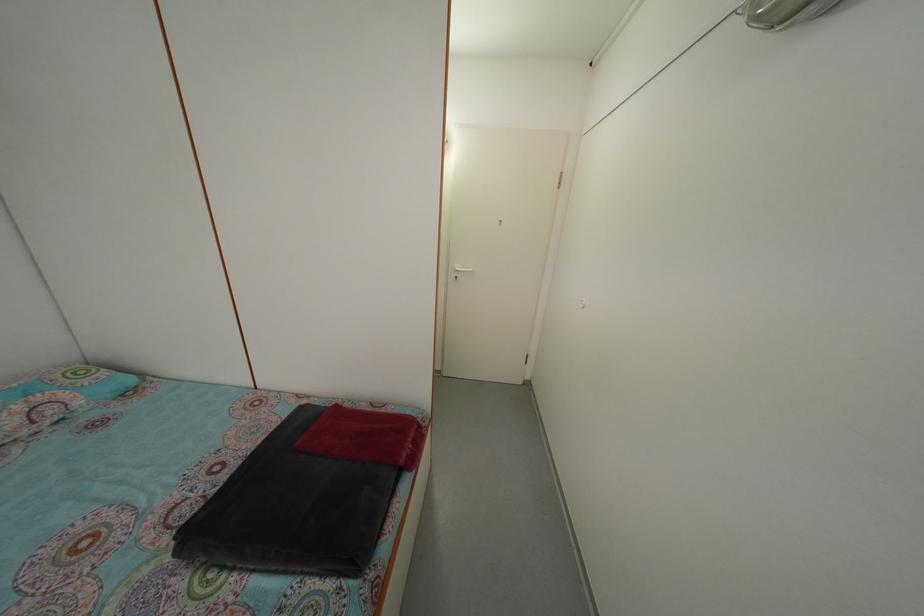
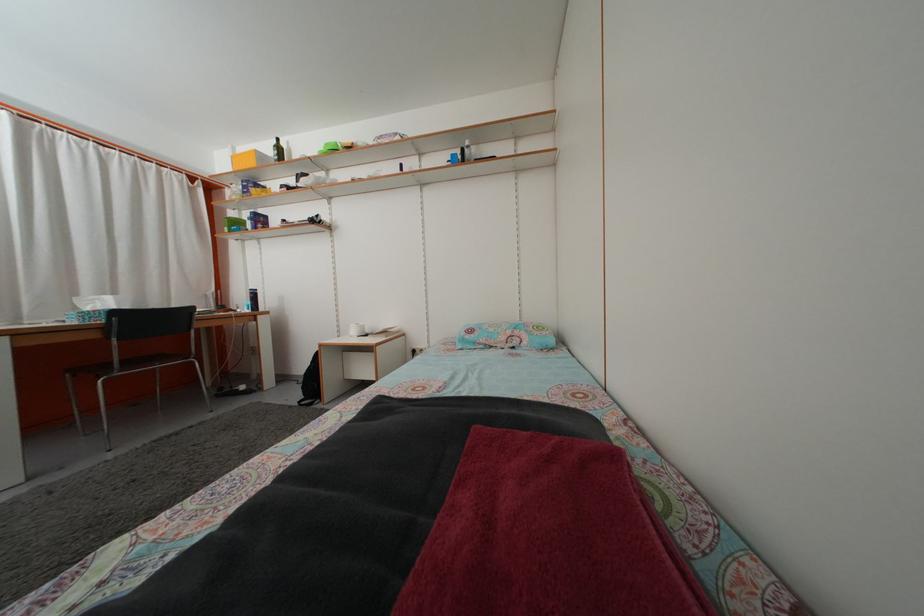
Question: How did the camera likely rotate?

Choices:
 (A) Left
 (B) Right
 (C) Up
 (D) Down

Answer: (A)